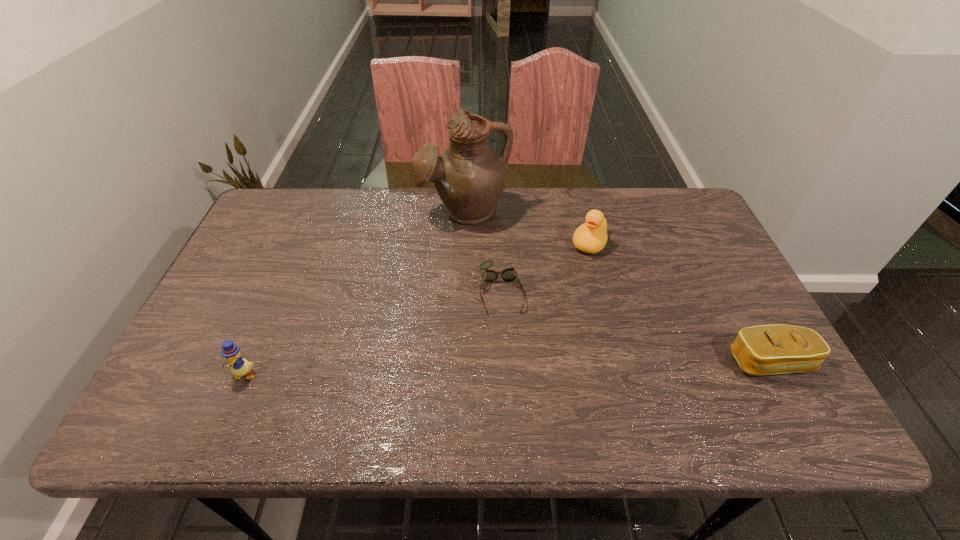
The image size is (960, 540). What are the coordinates of `object at the left edge` in the screenshot? It's located at (240, 367).

Locate an element on the screen. The image size is (960, 540). object that is at the right edge is located at coordinates (767, 349).

At what (x,y) coordinates should I click in order to perform the action: click on object situated at the near left corner. Please return your answer as a coordinate pair (x, y). The width and height of the screenshot is (960, 540). Looking at the image, I should click on (240, 367).

Find the location of `object present at the near right corner`. object present at the near right corner is located at coordinates (767, 349).

The width and height of the screenshot is (960, 540). Find the location of `free region at the far edge`. free region at the far edge is located at coordinates (556, 225).

At what (x,y) coordinates should I click in order to perform the action: click on vacant space at the near edge of the desktop. Please return your answer as a coordinate pair (x, y). This screenshot has height=540, width=960. Looking at the image, I should click on (441, 393).

I want to click on blank space at the left edge of the desktop, so click(x=248, y=338).

The height and width of the screenshot is (540, 960). In the image, there is a desktop. Identify the location of free region at the right edge. (689, 282).

This screenshot has height=540, width=960. In the image, there is a desktop. What are the coordinates of `vacant space at the far right corner` in the screenshot? It's located at (650, 203).

The width and height of the screenshot is (960, 540). Find the location of `vacant space that is in between the shortest object and the pitcher`. vacant space that is in between the shortest object and the pitcher is located at coordinates (483, 251).